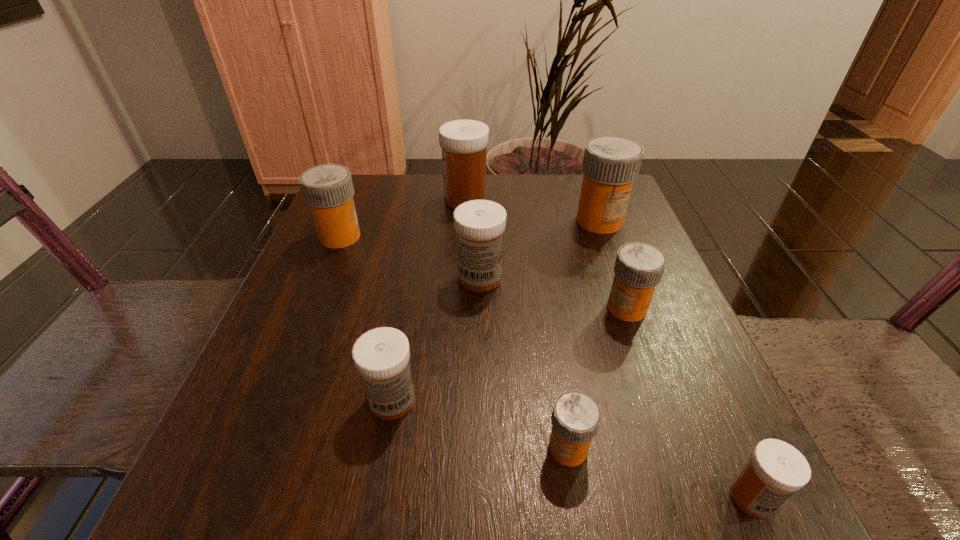
Locate an element on the screen. The image size is (960, 540). free space between the biggest orange medicine and the farthest white medicine is located at coordinates (533, 210).

This screenshot has width=960, height=540. Find the location of `empty space between the leftmost object and the seventh medicine from right to left`. empty space between the leftmost object and the seventh medicine from right to left is located at coordinates (366, 319).

At what (x,y) coordinates should I click in order to perform the action: click on empty location between the third farthest orange medicine and the third smallest white medicine. Please return your answer as a coordinate pair (x, y). The height and width of the screenshot is (540, 960). Looking at the image, I should click on (553, 293).

Identify the location of the third closest object to the rightmost white medicine. The image size is (960, 540). (381, 356).

Where is `the seventh closest object to the biggest white medicine`? the seventh closest object to the biggest white medicine is located at coordinates (775, 470).

Identify which medicine is the sixth nearest to the fourth medicine from right to left. Please provide its 2D coordinates. Your answer should be formatted as a tuple, i.e. [(x, y)], where the tuple contains the x and y coordinates of a point satisfying the conditions above.

[(328, 189)]

Point out which medicine is positioned as the seventh nearest to the third biggest orange medicine. Please provide its 2D coordinates. Your answer should be formatted as a tuple, i.e. [(x, y)], where the tuple contains the x and y coordinates of a point satisfying the conditions above.

[(328, 189)]

Locate an element on the screen. This screenshot has width=960, height=540. orange medicine object that ranks as the third closest to the biggest white medicine is located at coordinates (639, 267).

The width and height of the screenshot is (960, 540). Find the location of `orange medicine that is the third closest to the third biggest white medicine`. orange medicine that is the third closest to the third biggest white medicine is located at coordinates (639, 267).

Identify which white medicine is the third nearest to the second biggest white medicine. Please provide its 2D coordinates. Your answer should be formatted as a tuple, i.e. [(x, y)], where the tuple contains the x and y coordinates of a point satisfying the conditions above.

[(775, 470)]